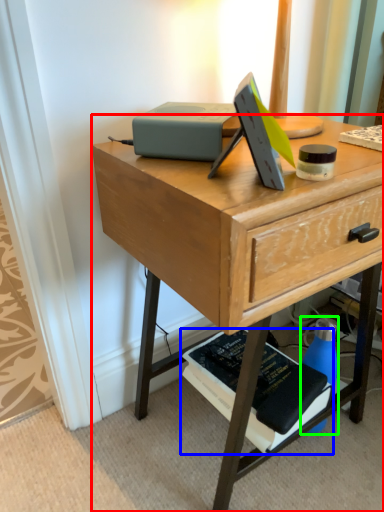
Question: Estimate the real-world distances between objects in this image. Which object is closer to desk (highlighted by a red box), paperback book (highlighted by a blue box) or bottle (highlighted by a green box)?

Choices:
 (A) paperback book
 (B) bottle

Answer: (A)